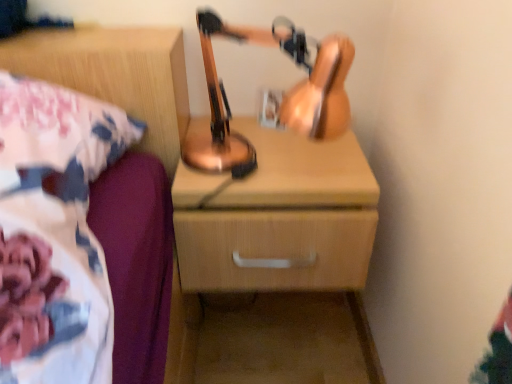
Locate an element on the screen. The image size is (512, 384). free spot below copper metallic table lamp at center (from a real-world perspective) is located at coordinates (265, 172).